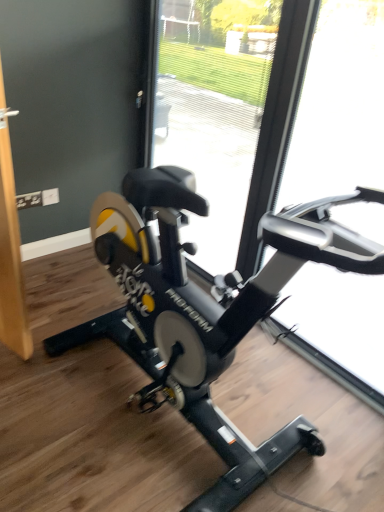
Question: Is black matte stationary bicycle at center aimed at transparent glass door at center, which is the 2th glass door in right-to-left order?

Choices:
 (A) no
 (B) yes

Answer: (A)

Question: Is black matte stationary bicycle at center at the left side of transparent glass door at center, which is the 2th glass door in right-to-left order?

Choices:
 (A) yes
 (B) no

Answer: (A)

Question: Is black matte stationary bicycle at center oriented away from transparent glass door at center, which ranks as the 1th glass door in left-to-right order?

Choices:
 (A) yes
 (B) no

Answer: (B)

Question: From a real-world perspective, is black matte stationary bicycle at center physically below transparent glass door at center, which ranks as the 1th glass door in left-to-right order?

Choices:
 (A) no
 (B) yes

Answer: (B)

Question: From the image's perspective, is black matte stationary bicycle at center below transparent glass door at center, which ranks as the 1th glass door in left-to-right order?

Choices:
 (A) no
 (B) yes

Answer: (B)

Question: Is transparent glass door at right, which appears as the first glass door when viewed from the right, taller or shorter than transparent glass door at center, which ranks as the 1th glass door in left-to-right order?

Choices:
 (A) tall
 (B) short

Answer: (A)

Question: Based on their sizes in the image, would you say transparent glass door at right, which appears as the first glass door when viewed from the right, is bigger or smaller than transparent glass door at center, which ranks as the 1th glass door in left-to-right order?

Choices:
 (A) big
 (B) small

Answer: (B)

Question: Would you say transparent glass door at right, which appears as the first glass door when viewed from the right, is inside or outside transparent glass door at center, which ranks as the 1th glass door in left-to-right order?

Choices:
 (A) inside
 (B) outside

Answer: (B)

Question: From a real-world perspective, is transparent glass door at right, which is the second glass door from left to right, physically located above or below transparent glass door at center, which ranks as the 1th glass door in left-to-right order?

Choices:
 (A) above
 (B) below

Answer: (A)

Question: From the image's perspective, is transparent glass door at right, which appears as the first glass door when viewed from the right, above or below black matte stationary bicycle at center?

Choices:
 (A) above
 (B) below

Answer: (A)

Question: Is transparent glass door at right, which appears as the first glass door when viewed from the right, spatially inside black matte stationary bicycle at center, or outside of it?

Choices:
 (A) outside
 (B) inside

Answer: (A)

Question: Considering the positions of point (344, 30) and point (178, 373), is point (344, 30) closer or farther from the camera than point (178, 373)?

Choices:
 (A) farther
 (B) closer

Answer: (A)

Question: Considering the positions of transparent glass door at right, which is the second glass door from left to right, and black matte stationary bicycle at center in the image, is transparent glass door at right, which is the second glass door from left to right, bigger or smaller than black matte stationary bicycle at center?

Choices:
 (A) big
 (B) small

Answer: (B)

Question: Looking at their shapes, would you say transparent glass door at center, which ranks as the 1th glass door in left-to-right order, is wider or thinner than transparent glass door at right, which appears as the first glass door when viewed from the right?

Choices:
 (A) wide
 (B) thin

Answer: (A)

Question: Choose the correct answer: Is transparent glass door at center, which ranks as the 1th glass door in left-to-right order, inside transparent glass door at right, which appears as the first glass door when viewed from the right, or outside it?

Choices:
 (A) outside
 (B) inside

Answer: (A)